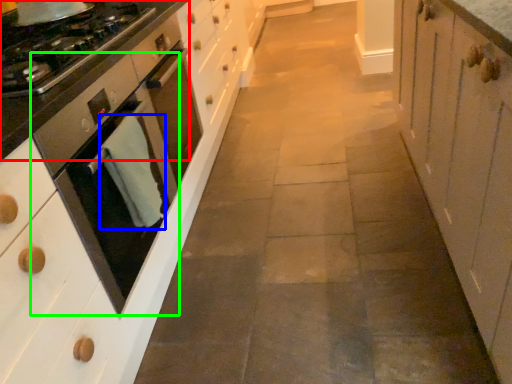
Question: Which is nearer to the countertop (highlighted by a red box)? material (highlighted by a blue box) or home appliance (highlighted by a green box).

Choices:
 (A) material
 (B) home appliance

Answer: (B)